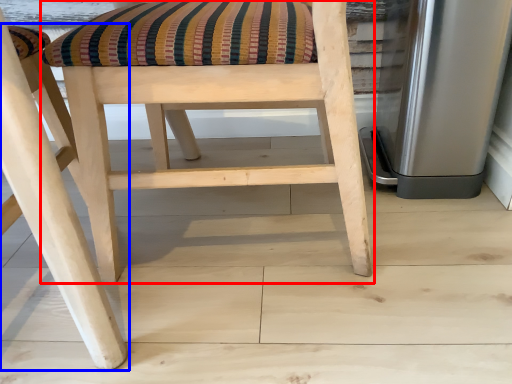
Question: Among these objects, which one is nearest to the camera, chair (highlighted by a red box) or chair (highlighted by a blue box)?

Choices:
 (A) chair
 (B) chair

Answer: (B)